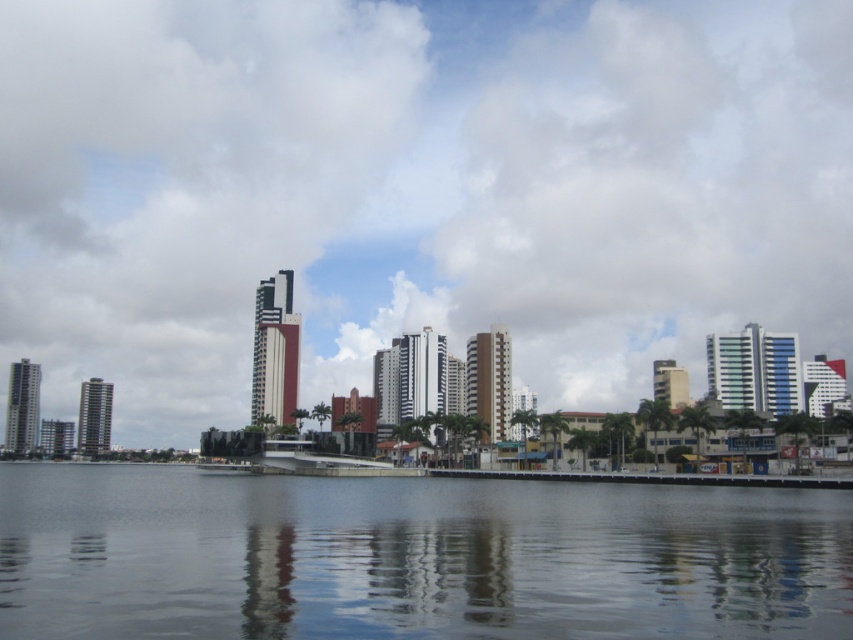
Does white fluffy cloud at upper center have a lesser height compared to transparent glass water at center?

No.

Is white fluffy cloud at upper center positioned at the back of transparent glass water at center?

Yes, it is behind transparent glass water at center.

Who is more distant from viewer, (172, 324) or (254, 541)?

Point (172, 324)

You are a GUI agent. You are given a task and a screenshot of the screen. Output one action in this format:
    pyautogui.click(x=<x>, y=<y>)
    Task: Click on the white fluffy cloud at upper center
    The width and height of the screenshot is (853, 640).
    Given the screenshot: What is the action you would take?
    pyautogui.click(x=415, y=192)